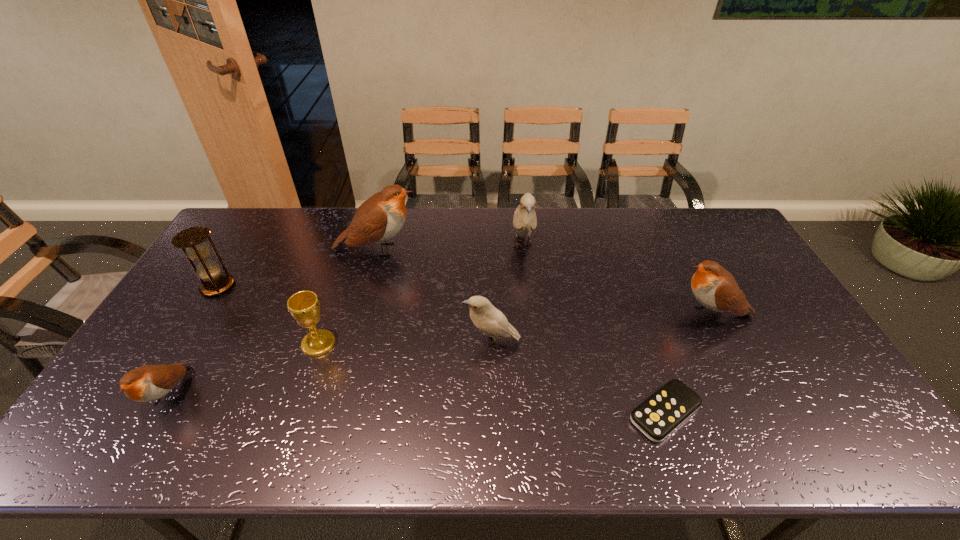
Identify the location of vacant region that satisfies the following two spatial constraints: 1. at the face of the leftmost brown bird; 2. on the right side of the remote control. (159, 412).

This screenshot has width=960, height=540. I want to click on free space that satisfies the following two spatial constraints: 1. at the beak of the farther white bird; 2. at the beak of the smaller white bird, so click(534, 342).

I want to click on free space that satisfies the following two spatial constraints: 1. at the face of the rightmost bird; 2. on the front side of the remote control, so click(x=763, y=412).

Locate an element on the screen. Image resolution: width=960 pixels, height=540 pixels. free space that satisfies the following two spatial constraints: 1. at the beak of the seventh object from left to right; 2. on the left side of the second nearest bird is located at coordinates (492, 412).

Identify the location of vacant position in the image that satisfies the following two spatial constraints: 1. at the face of the seventh object from left to right; 2. on the right side of the leftmost brown bird. (159, 412).

In order to click on vacant region that satisfies the following two spatial constraints: 1. at the beak of the remote control; 2. on the right side of the farther white bird in this screenshot , I will do `click(541, 412)`.

Where is `free spot that satisfies the following two spatial constraints: 1. at the face of the fourth bird from right to left; 2. on the left side of the remote control`? The width and height of the screenshot is (960, 540). free spot that satisfies the following two spatial constraints: 1. at the face of the fourth bird from right to left; 2. on the left side of the remote control is located at coordinates (333, 412).